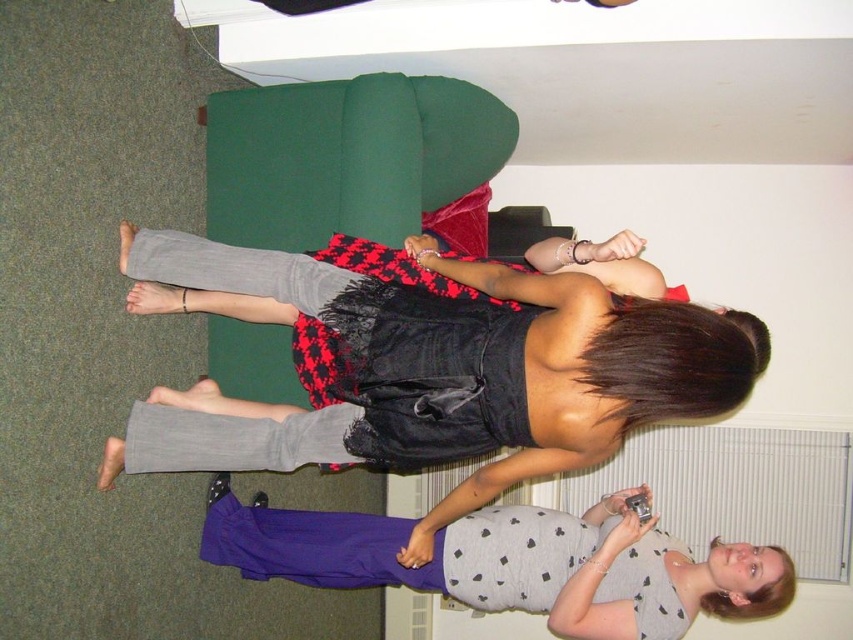
Does black satin dress at center appear under gray dotted tank top at lower center?

Actually, black satin dress at center is above gray dotted tank top at lower center.

Is black satin dress at center shorter than gray dotted tank top at lower center?

Incorrect, black satin dress at center's height does not fall short of gray dotted tank top at lower center's.

Is point (604, 328) positioned after point (683, 557)?

No, it is in front of (683, 557).

The height and width of the screenshot is (640, 853). I want to click on black satin dress at center, so click(x=437, y=365).